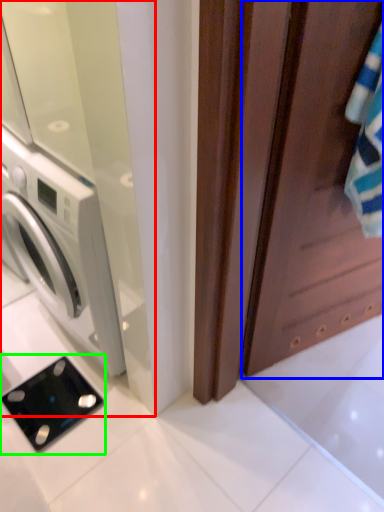
Question: Considering the real-world distances, which object is closest to screen door (highlighted by a red box)? screen door (highlighted by a blue box) or appliance (highlighted by a green box).

Choices:
 (A) screen door
 (B) appliance

Answer: (A)